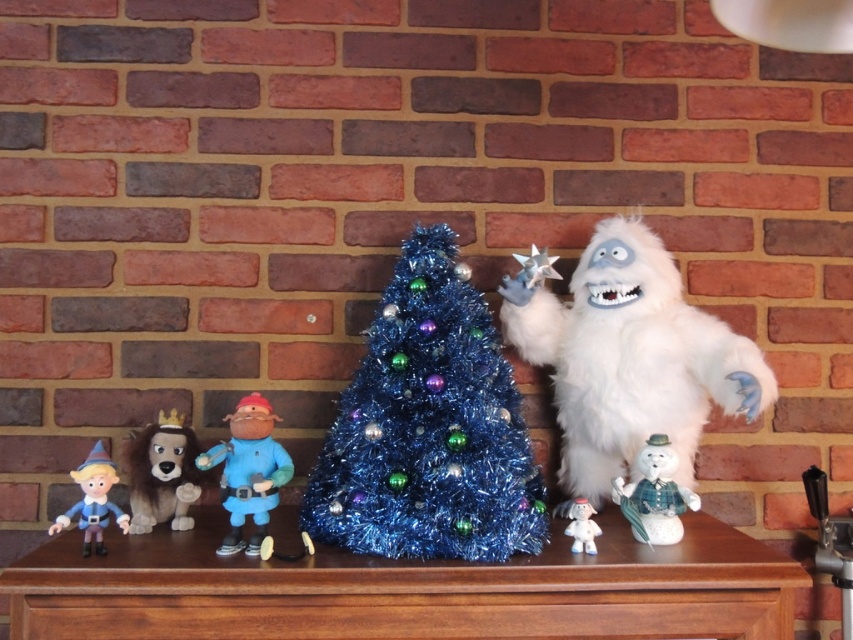
You are setting up a display on a table and need to place the white fluffy ghost at right and the white fluffy doll at lower center. The display requires that the two items must be exactly 6 inches apart. Can you place them according to the requirement?

The white fluffy ghost at right is 6.19 inches from the white fluffy doll at lower center, so it is slightly more than the required 6 inches. Therefore, you can adjust their positions to meet the exact distance requirement.

You are setting up a display on a table and need to arrange items according to their positions. You have a brown plush toy at left and a white fluffy doll at lower center. Based on the scene description, which item is placed higher on the table?

The brown plush toy at left is positioned over the white fluffy doll at lower center, meaning it is placed higher on the table.